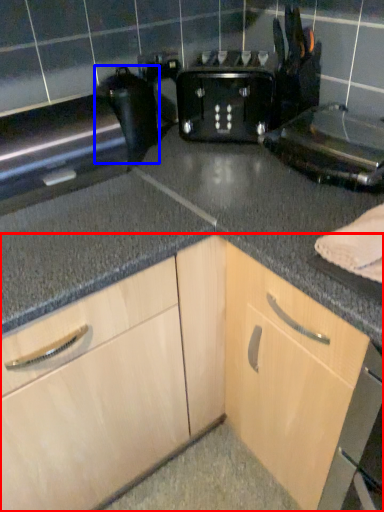
Question: Among these objects, which one is nearest to the camera, cabinetry (highlighted by a red box) or appliance (highlighted by a blue box)?

Choices:
 (A) cabinetry
 (B) appliance

Answer: (A)